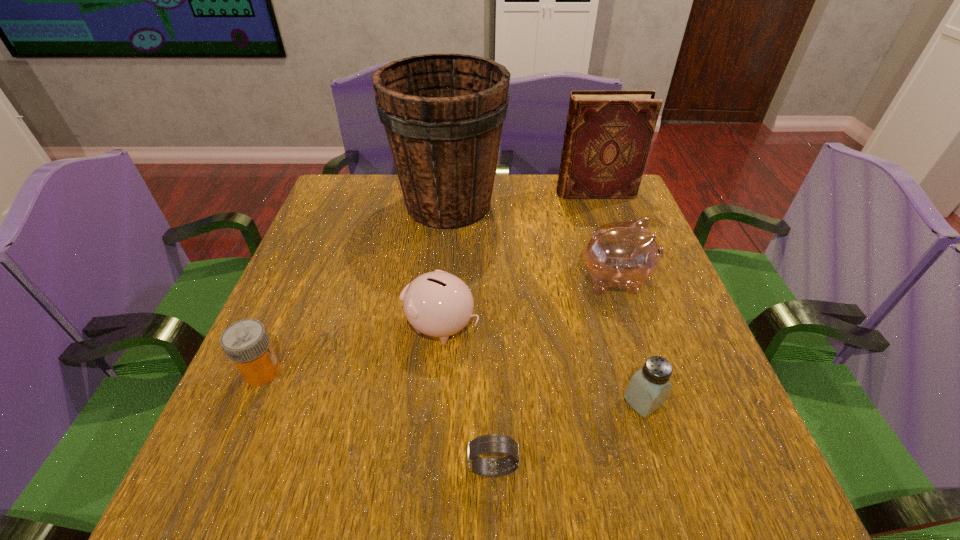
Identify the location of bucket that is at the far edge. This screenshot has width=960, height=540. (443, 114).

The image size is (960, 540). I want to click on hardback book that is at the far edge, so click(x=608, y=135).

This screenshot has height=540, width=960. I want to click on object that is at the near edge, so click(x=492, y=443).

The height and width of the screenshot is (540, 960). Identify the location of object that is positioned at the left edge. (246, 342).

At what (x,y) coordinates should I click in order to perform the action: click on hardback book that is at the right edge. Please return your answer as a coordinate pair (x, y). The width and height of the screenshot is (960, 540). Looking at the image, I should click on (608, 135).

Identify the location of piggy bank that is at the right edge. (625, 254).

I want to click on saltshaker that is at the right edge, so click(x=648, y=389).

Where is `object positioned at the far right corner`? object positioned at the far right corner is located at coordinates (608, 135).

The height and width of the screenshot is (540, 960). In the image, there is a desktop. In order to click on free space at the near edge in this screenshot , I will do click(469, 475).

I want to click on vacant position at the left edge of the desktop, so click(x=276, y=444).